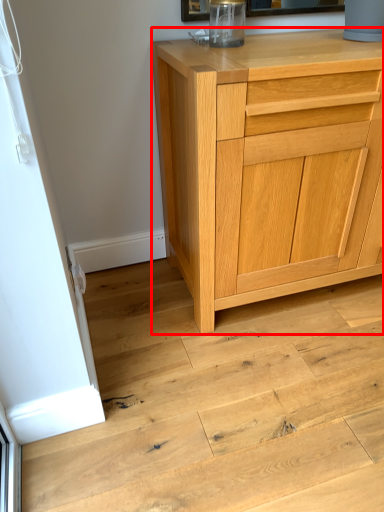
Question: From the image, what is the correct spatial relationship of chest of drawers (annotated by the red box) in relation to stair?

Choices:
 (A) left
 (B) right

Answer: (B)